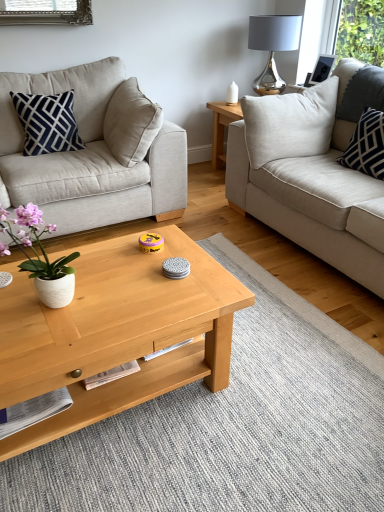
Question: Is light gray fabric couch at right, the second studio couch in the left-to-right sequence, to the right of shiny metallic lamp at upper right from the viewer's perspective?

Choices:
 (A) no
 (B) yes

Answer: (B)

Question: From a real-world perspective, is light gray fabric couch at right, the second studio couch in the left-to-right sequence, physically above shiny metallic lamp at upper right?

Choices:
 (A) yes
 (B) no

Answer: (B)

Question: Is the position of light gray fabric couch at right, the second studio couch in the left-to-right sequence, more distant than that of shiny metallic lamp at upper right?

Choices:
 (A) no
 (B) yes

Answer: (A)

Question: Is light gray fabric couch at right, acting as the 1th studio couch starting from the right, surrounding shiny metallic lamp at upper right?

Choices:
 (A) no
 (B) yes

Answer: (A)

Question: Is light gray fabric couch at right, the second studio couch in the left-to-right sequence, taller than shiny metallic lamp at upper right?

Choices:
 (A) no
 (B) yes

Answer: (B)

Question: Can we say light gray fabric couch at right, acting as the 1th studio couch starting from the right, lies outside shiny metallic lamp at upper right?

Choices:
 (A) yes
 (B) no

Answer: (A)

Question: From the image's perspective, is beige fabric couch at left, the first studio couch from the left, on navy blue fabric pillow at left, marked as the 1th pillow in a left-to-right arrangement?

Choices:
 (A) no
 (B) yes

Answer: (A)

Question: From the image's perspective, would you say beige fabric couch at left, the first studio couch from the left, is shown under navy blue fabric pillow at left, which appears as the 2th pillow when viewed from the right?

Choices:
 (A) no
 (B) yes

Answer: (B)

Question: Does beige fabric couch at left, the first studio couch from the left, come behind navy blue fabric pillow at left, marked as the 1th pillow in a left-to-right arrangement?

Choices:
 (A) yes
 (B) no

Answer: (B)

Question: Would you say beige fabric couch at left, which is the second studio couch from right to left, is a long distance from navy blue fabric pillow at left, which appears as the 2th pillow when viewed from the right?

Choices:
 (A) no
 (B) yes

Answer: (A)

Question: Is beige fabric couch at left, the first studio couch from the left, shorter than navy blue fabric pillow at left, which appears as the 2th pillow when viewed from the right?

Choices:
 (A) no
 (B) yes

Answer: (A)

Question: Is beige fabric couch at left, which is the second studio couch from right to left, touching navy blue fabric pillow at left, which appears as the 2th pillow when viewed from the right?

Choices:
 (A) yes
 (B) no

Answer: (B)

Question: Can you confirm if white textured pillow at right, positioned as the 1th pillow in right-to-left order, is positioned to the left of shiny metallic lamp at upper right?

Choices:
 (A) yes
 (B) no

Answer: (B)